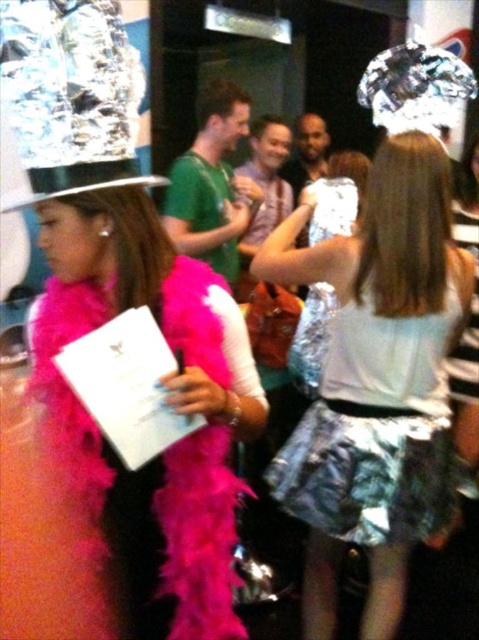
Question: Which object appears farthest from the camera in this image?

Choices:
 (A) matte pink shirt at center
 (B) pink feather boa at center

Answer: (A)

Question: Considering the real-world distances, which object is farthest from the shiny silver skirt at center?

Choices:
 (A) matte pink shirt at center
 (B) green matte shirt at center
 (C) pink feather boa at center
 (D) shiny metallic dress at center

Answer: (A)

Question: Is shiny silver skirt at center wider than shiny silver hat at center?

Choices:
 (A) no
 (B) yes

Answer: (B)

Question: Considering the relative positions of green matte shirt at center and matte pink shirt at center in the image provided, where is green matte shirt at center located with respect to matte pink shirt at center?

Choices:
 (A) left
 (B) right

Answer: (A)

Question: Which of the following is the closest to the observer?

Choices:
 (A) pink feather boa at center
 (B) matte pink shirt at center

Answer: (A)

Question: Does shiny metallic dress at center have a smaller size compared to matte pink shirt at center?

Choices:
 (A) yes
 (B) no

Answer: (A)